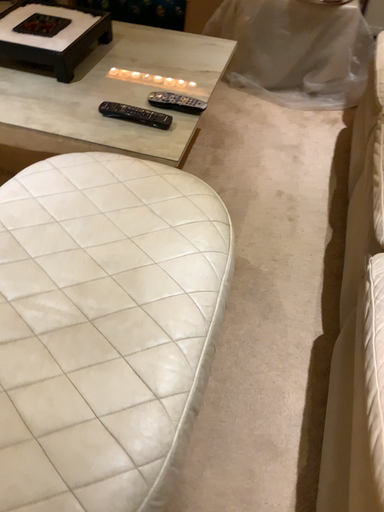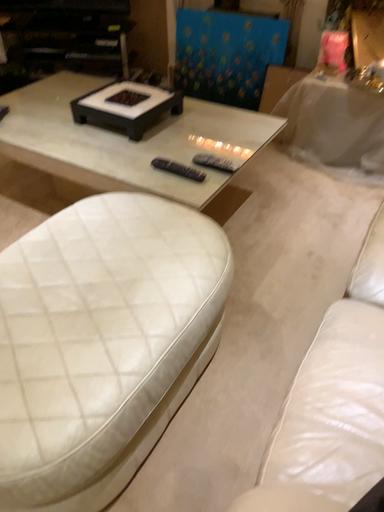
Question: Which way did the camera rotate in the video?

Choices:
 (A) rotated left
 (B) rotated right

Answer: (A)